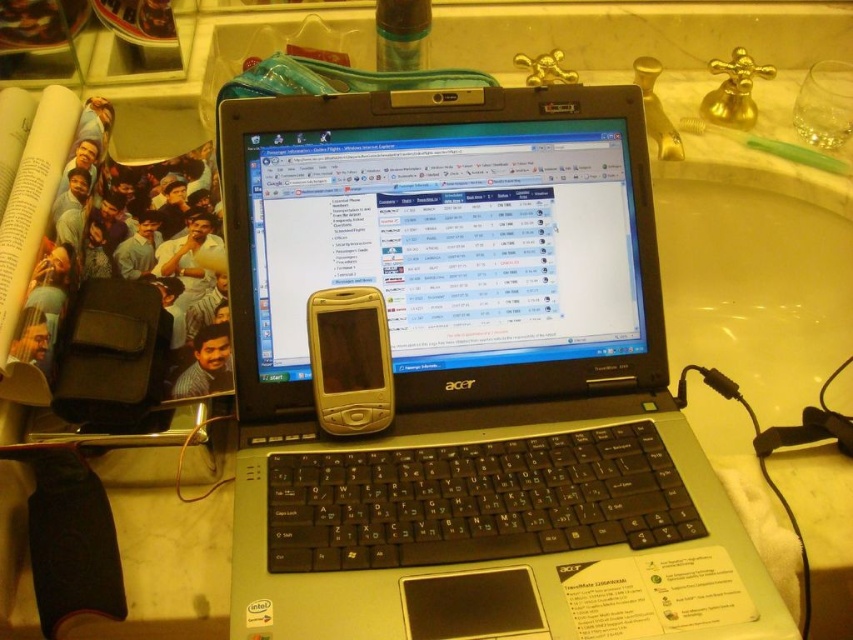
Which is more to the left, black plastic laptop at center or gold plastic phone at center?

gold plastic phone at center

From the picture: Who is positioned more to the right, black plastic laptop at center or gold plastic phone at center?

From the viewer's perspective, black plastic laptop at center appears more on the right side.

You are a GUI agent. You are given a task and a screenshot of the screen. Output one action in this format:
    pyautogui.click(x=<x>, y=<y>)
    Task: Click on the black plastic laptop at center
    
    Given the screenshot: What is the action you would take?
    pyautogui.click(x=469, y=380)

This screenshot has height=640, width=853. I want to click on black plastic laptop at center, so click(469, 380).